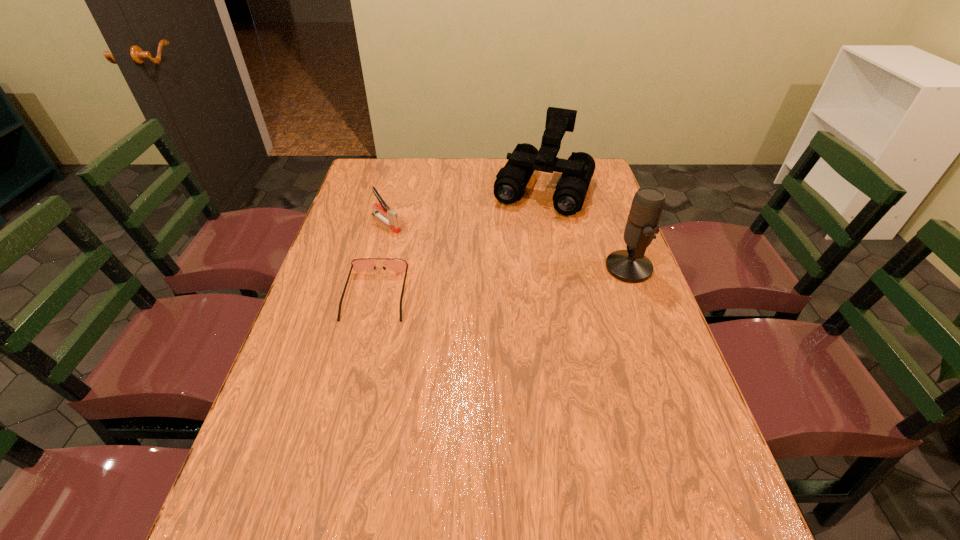
Locate an element on the screen. This screenshot has width=960, height=540. vacant space that is in between the microphone and the shortest object is located at coordinates pos(502,281).

What are the coordinates of `empty space between the third tallest object and the sunglasses` in the screenshot? It's located at (381, 259).

Where is `vacant point located between the microphone and the stapler`? This screenshot has height=540, width=960. vacant point located between the microphone and the stapler is located at coordinates (508, 245).

Locate an element on the screen. Image resolution: width=960 pixels, height=540 pixels. object that stands as the third closest to the binoculars is located at coordinates (362, 264).

Where is `the third closest object to the microphone`? The image size is (960, 540). the third closest object to the microphone is located at coordinates (393, 221).

Locate an element on the screen. The width and height of the screenshot is (960, 540). free space that satisfies the following two spatial constraints: 1. on the front side of the third tallest object; 2. on the side of the microphone with the red ring is located at coordinates (374, 268).